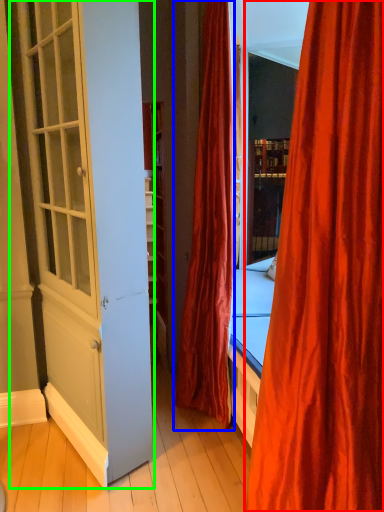
Question: Which object is positioned farthest from curtain (highlighted by a red box)? Select from curtain (highlighted by a blue box) and screen door (highlighted by a green box).

Choices:
 (A) curtain
 (B) screen door

Answer: (A)